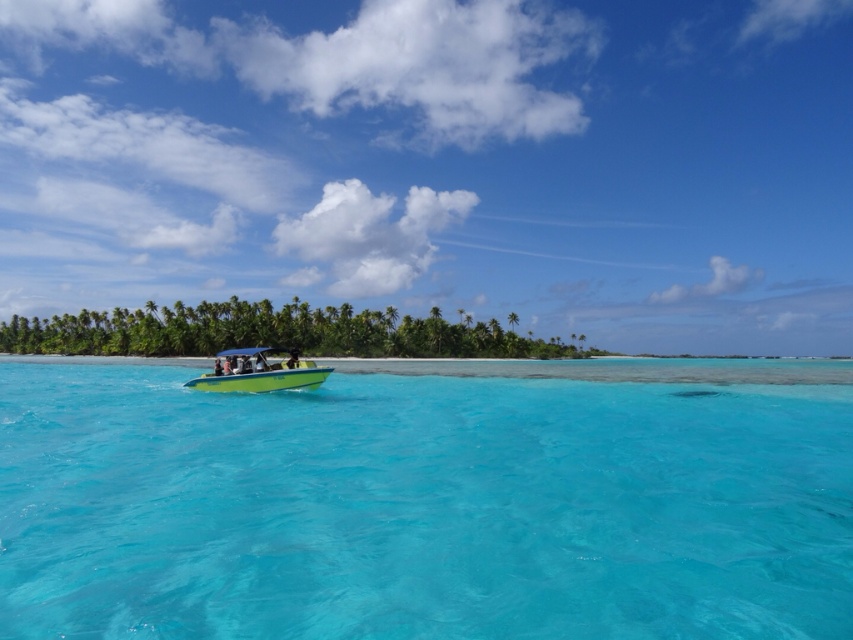
Who is more distant from viewer, [245,520] or [291,349]?

Point [291,349]

Between transparent blue water at center and green plastic boat at center, which one appears on the left side from the viewer's perspective?

Positioned to the left is green plastic boat at center.

You are a GUI agent. You are given a task and a screenshot of the screen. Output one action in this format:
    pyautogui.click(x=<x>, y=<y>)
    Task: Click on the transparent blue water at center
    The height and width of the screenshot is (640, 853).
    Given the screenshot: What is the action you would take?
    pyautogui.click(x=421, y=508)